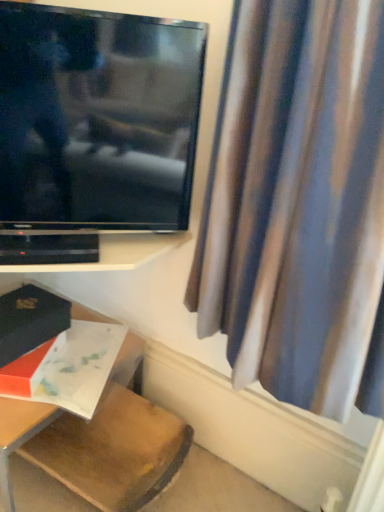
Locate an element on the screen. This screenshot has height=512, width=384. vacant space underneath flat screen tv at upper left (from a real-world perspective) is located at coordinates (89, 253).